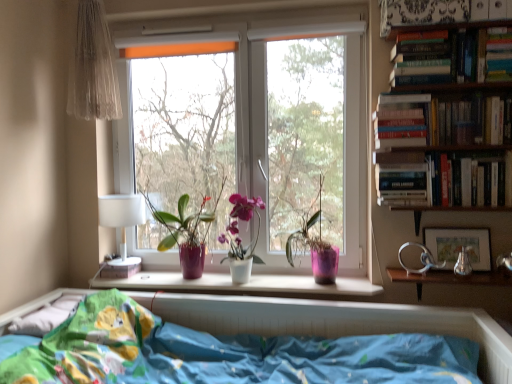
You are a GUI agent. You are given a task and a screenshot of the screen. Output one action in this format:
    pyautogui.click(x=<x>, y=<y>)
    Task: Click on the pink matte pot at center, acting as the third houseplant starting from the left
    
    Given the screenshot: What is the action you would take?
    pyautogui.click(x=315, y=244)

The image size is (512, 384). In order to click on transparent plastic window at center in this screenshot , I will do `click(308, 135)`.

Describe the element at coordinates (440, 121) in the screenshot. I see `hardcover books at upper right, arranged as the second book when ordered from the bottom` at that location.

Where is `pink matte pot at center, the first houseplant positioned from the right`? This screenshot has height=384, width=512. pink matte pot at center, the first houseplant positioned from the right is located at coordinates (315, 244).

Between hardcover book at upper right, which is the 1th paperback book in left-to-right order, and matte silver picture frame at right, which one has larger width?

With larger width is hardcover book at upper right, which is the 1th paperback book in left-to-right order.

Is hardcover book at upper right, which is the 3th paperback book from top to bottom, turned away from matte silver picture frame at right?

No, hardcover book at upper right, which is the 3th paperback book from top to bottom, is not facing the opposite direction of matte silver picture frame at right.

Considering the positions of point (398, 167) and point (467, 239), is point (398, 167) closer or farther from the camera than point (467, 239)?

Point (398, 167) is positioned closer to the camera compared to point (467, 239).

From a real-world perspective, is hardcover book at upper right, which is the 3th paperback book from top to bottom, positioned above or below matte silver picture frame at right?

hardcover book at upper right, which is the 3th paperback book from top to bottom, is above matte silver picture frame at right.

Can you confirm if hardcover book at upper right, which is the 1th book in top-to-bottom order, is wider than transparent plastic window at center?

Correct, the width of hardcover book at upper right, which is the 1th book in top-to-bottom order, exceeds that of transparent plastic window at center.

Is hardcover book at upper right, which is the 4th book in bottom-to-top order, to the right of transparent plastic window at center from the viewer's perspective?

Indeed, hardcover book at upper right, which is the 4th book in bottom-to-top order, is positioned on the right side of transparent plastic window at center.

How many degrees apart are the facing directions of hardcover book at upper right, which is the 4th book in bottom-to-top order, and transparent plastic window at center?

The angle between the facing direction of hardcover book at upper right, which is the 4th book in bottom-to-top order, and the facing direction of transparent plastic window at center is 1.16 degrees.

Does hardcover book at upper right, which is the 1th book in top-to-bottom order, have a greater height compared to transparent plastic window at center?

No.

From their relative heights in the image, would you say matte silver picture frame at right is taller or shorter than hardcover book at upper right, acting as the 2th paperback book starting from the top?

Clearly, matte silver picture frame at right is shorter compared to hardcover book at upper right, acting as the 2th paperback book starting from the top.

From the picture: Is matte silver picture frame at right not within hardcover book at upper right, which is counted as the 2th paperback book, starting from the left?

matte silver picture frame at right lies outside hardcover book at upper right, which is counted as the 2th paperback book, starting from the left,'s area.

Are matte silver picture frame at right and hardcover book at upper right, the second paperback book from the right, located far from each other?

No, matte silver picture frame at right is not far from hardcover book at upper right, the second paperback book from the right.

Can you confirm if hardcover book at upper right, which is the 3th paperback book from left to right, is positioned to the right of white matte window sill at center?

Indeed, hardcover book at upper right, which is the 3th paperback book from left to right, is positioned on the right side of white matte window sill at center.

Which object is closer to the camera, hardcover book at upper right, marked as the first paperback book in a top-to-bottom arrangement, or white matte window sill at center?

hardcover book at upper right, marked as the first paperback book in a top-to-bottom arrangement, is more forward.

From the image's perspective, does hardcover book at upper right, positioned as the third paperback book in bottom-to-top order, appear lower than white matte window sill at center?

Incorrect, from the image's perspective, hardcover book at upper right, positioned as the third paperback book in bottom-to-top order, is higher than white matte window sill at center.

From a real-world perspective, which is physically above, hardcover book at upper right, the 1th paperback book in the right-to-left sequence, or white matte window sill at center?

hardcover book at upper right, the 1th paperback book in the right-to-left sequence, from a real-world perspective.

Is white fabric lampshade at left far away from translucent fabric curtain at upper left?

No, white fabric lampshade at left is in close proximity to translucent fabric curtain at upper left.

From the picture: Does white fabric lampshade at left turn towards translucent fabric curtain at upper left?

No, white fabric lampshade at left is not turned towards translucent fabric curtain at upper left.

Is translucent fabric curtain at upper left located within white fabric lampshade at left?

That's incorrect, translucent fabric curtain at upper left is not inside white fabric lampshade at left.

Is hardcover book at upper right, acting as the 2th paperback book starting from the top, positioned beyond the bounds of white plastic window at center?

hardcover book at upper right, acting as the 2th paperback book starting from the top, lies outside white plastic window at center's area.

Is hardcover book at upper right, which is counted as the 2th paperback book, starting from the left, looking in the opposite direction of white plastic window at center?

No, hardcover book at upper right, which is counted as the 2th paperback book, starting from the left,'s orientation is not away from white plastic window at center.

Is hardcover book at upper right, which appears as the second paperback book when ordered from the bottom, bigger than white plastic window at center?

Actually, hardcover book at upper right, which appears as the second paperback book when ordered from the bottom, might be smaller than white plastic window at center.

Considering the relative sizes of white plastic window at center and hardcover book at upper right, which is the 4th book in bottom-to-top order, in the image provided, is white plastic window at center shorter than hardcover book at upper right, which is the 4th book in bottom-to-top order,?

No.

From the image's perspective, does white plastic window at center appear higher than hardcover book at upper right, which is the 1th book in top-to-bottom order?

No, from the image's perspective, white plastic window at center is not on top of hardcover book at upper right, which is the 1th book in top-to-bottom order.

You are a GUI agent. You are given a task and a screenshot of the screen. Output one action in this format:
    pyautogui.click(x=<x>, y=<y>)
    Task: Click on the window located on the left of hardcover book at upper right, which is the 1th book in top-to-bottom order
    
    Given the screenshot: What is the action you would take?
    pyautogui.click(x=255, y=125)

Is white plastic window at center directly adjacent to hardcover book at upper right, which is the 1th book in top-to-bottom order?

No, white plastic window at center is not with hardcover book at upper right, which is the 1th book in top-to-bottom order.

This screenshot has width=512, height=384. In order to click on picture frame that is on the right side of hardcover book at upper right, which is counted as the first paperback book, starting from the bottom in this screenshot , I will do `click(459, 246)`.

You are a GUI agent. You are given a task and a screenshot of the screen. Output one action in this format:
    pyautogui.click(x=<x>, y=<y>)
    Task: Click on the window screen on the left side of hardcover book at upper right, which is the 4th book in bottom-to-top order
    The height and width of the screenshot is (384, 512).
    Given the screenshot: What is the action you would take?
    pyautogui.click(x=308, y=135)

Consider the image. From the image, which object appears to be farther from hardcover book at upper right, marked as the first paperback book in a top-to-bottom arrangement, white matte window sill at center or hardcover book at upper right, which is counted as the first paperback book, starting from the bottom?

white matte window sill at center is further to hardcover book at upper right, marked as the first paperback book in a top-to-bottom arrangement.

From the image, which object appears to be nearer to hardcover book at upper right, which appears as the first book when ordered from the bottom, white plastic window at center or hardcover book at upper right, which is the 4th book in bottom-to-top order?

Based on the image, hardcover book at upper right, which is the 4th book in bottom-to-top order, appears to be nearer to hardcover book at upper right, which appears as the first book when ordered from the bottom.

Which object lies further to the anchor point white fabric lampshade at left, matte purple pot at center, the first houseplant from the left, or transparent plastic window at center?

The object further to white fabric lampshade at left is transparent plastic window at center.

Estimate the real-world distances between objects in this image. Which object is closer to hardcover book at upper right, which is the third paperback book from right to left, hardcover book at upper right, which is the third book in bottom-to-top order, or hardcover book at upper right, the 4th book when ordered from top to bottom?

Based on the image, hardcover book at upper right, the 4th book when ordered from top to bottom, appears to be nearer to hardcover book at upper right, which is the third paperback book from right to left.

From the image, which object appears to be nearer to green leafy tree at center, translucent fabric curtain at upper left or hardcover book at upper right, which is counted as the 2th paperback book, starting from the left?

translucent fabric curtain at upper left.

Looking at the image, which one is located further to hardcover book at upper right, which is the 3th paperback book from top to bottom, hardcover book at upper right, the 4th book when ordered from top to bottom, or white fabric lampshade at left?

white fabric lampshade at left is positioned further to the anchor hardcover book at upper right, which is the 3th paperback book from top to bottom.

Considering their positions, is hardcover book at upper right, positioned as the second book in top-to-bottom order, positioned closer to green leafy tree at center than hardcover books at upper right, arranged as the second book when ordered from the bottom?

hardcover books at upper right, arranged as the second book when ordered from the bottom, is positioned closer to the anchor green leafy tree at center.

Looking at the image, which one is located closer to hardcover books at upper right, arranged as the second book when ordered from the bottom, matte purple pot at center, which appears as the 3th houseplant when viewed from the right, or translucent fabric curtain at upper left?

matte purple pot at center, which appears as the 3th houseplant when viewed from the right, lies closer to hardcover books at upper right, arranged as the second book when ordered from the bottom, than the other object.

In order to click on picture frame located between white matte window sill at center and hardcover books at upper right, arranged as the second book when ordered from the bottom, in the left-right direction in this screenshot , I will do `click(459, 246)`.

Where is `houseplant between white glossy pot at center, the 2th houseplant viewed from the left, and hardcover book at upper right, which is counted as the first paperback book, starting from the bottom, from left to right`? houseplant between white glossy pot at center, the 2th houseplant viewed from the left, and hardcover book at upper right, which is counted as the first paperback book, starting from the bottom, from left to right is located at coordinates (315, 244).

Where is `window between translucent fabric curtain at upper left and hardcover book at upper right, positioned as the third paperback book in bottom-to-top order`? This screenshot has height=384, width=512. window between translucent fabric curtain at upper left and hardcover book at upper right, positioned as the third paperback book in bottom-to-top order is located at coordinates (255, 125).

The image size is (512, 384). What are the coordinates of `bed situated between white fabric lampshade at left and hardcover book at upper right, which is the 1th book in top-to-bottom order, from left to right` in the screenshot? It's located at (334, 321).